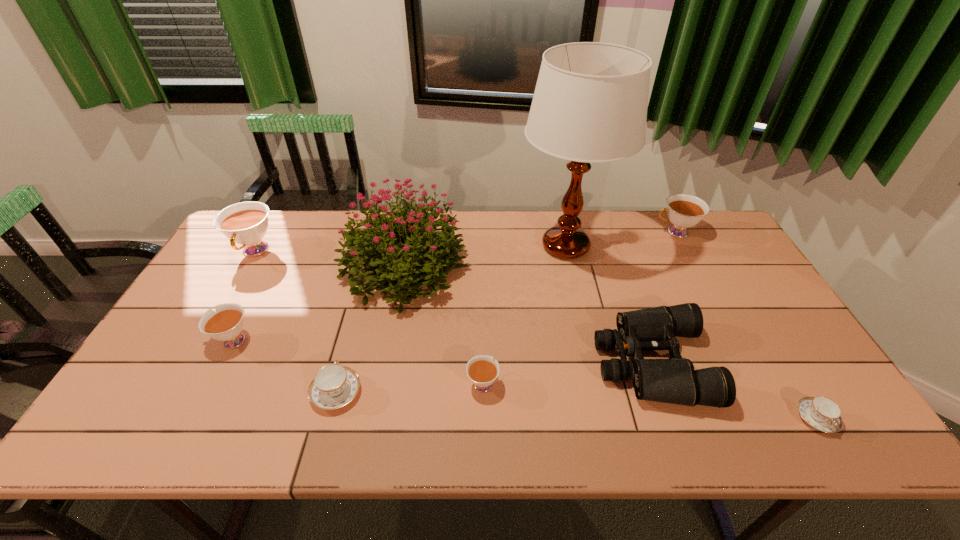
The image size is (960, 540). In order to click on free space at the far edge of the desktop in this screenshot , I will do `click(645, 243)`.

The width and height of the screenshot is (960, 540). Find the location of `vacant space at the right edge`. vacant space at the right edge is located at coordinates (718, 255).

Identify the location of free space at the far left corner of the desktop. (277, 238).

In the image, there is a desktop. Identify the location of vacant space at the far right corner. (707, 228).

Image resolution: width=960 pixels, height=540 pixels. Find the location of `free space between the bigger blue teacup and the second biggest white teacup`. free space between the bigger blue teacup and the second biggest white teacup is located at coordinates (506, 312).

Where is `unoccupied position between the third tallest object and the second biggest white teacup`? unoccupied position between the third tallest object and the second biggest white teacup is located at coordinates (465, 242).

At what (x,y) coordinates should I click in order to perform the action: click on empty space that is in between the rightmost white teacup and the biggest white teacup. Please return your answer as a coordinate pair (x, y). This screenshot has width=960, height=540. Looking at the image, I should click on (465, 242).

At what (x,y) coordinates should I click in order to perform the action: click on vacant area between the right blue teacup and the fourth nearest teacup. Please return your answer as a coordinate pair (x, y). The image size is (960, 540). Looking at the image, I should click on (524, 380).

Find the location of a particular element. This screenshot has width=960, height=540. unoccupied position between the third teacup from left to right and the shortest object is located at coordinates (576, 405).

Image resolution: width=960 pixels, height=540 pixels. What are the coordinates of `empty space between the fifth object from left to right and the black binoculars` in the screenshot? It's located at (567, 373).